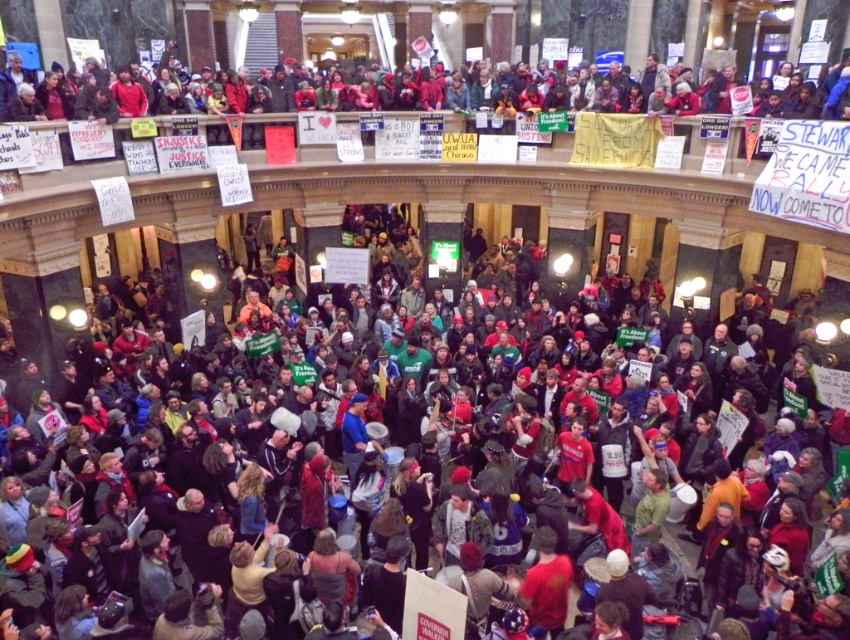
Question: Which point is closer to the camera?

Choices:
 (A) (486, 99)
 (B) (706, 464)

Answer: (B)

Question: Can you confirm if multicolored fabric crowd at center is positioned to the left of red fabric banner at upper center?

Choices:
 (A) no
 (B) yes

Answer: (B)

Question: Does multicolored fabric crowd at center appear on the right side of red fabric banner at upper center?

Choices:
 (A) yes
 (B) no

Answer: (B)

Question: Which of the following is the closest to the observer?

Choices:
 (A) (210, 381)
 (B) (278, 109)

Answer: (A)

Question: From the image, what is the correct spatial relationship of multicolored fabric crowd at center in relation to red fabric banner at upper center?

Choices:
 (A) above
 (B) below

Answer: (B)